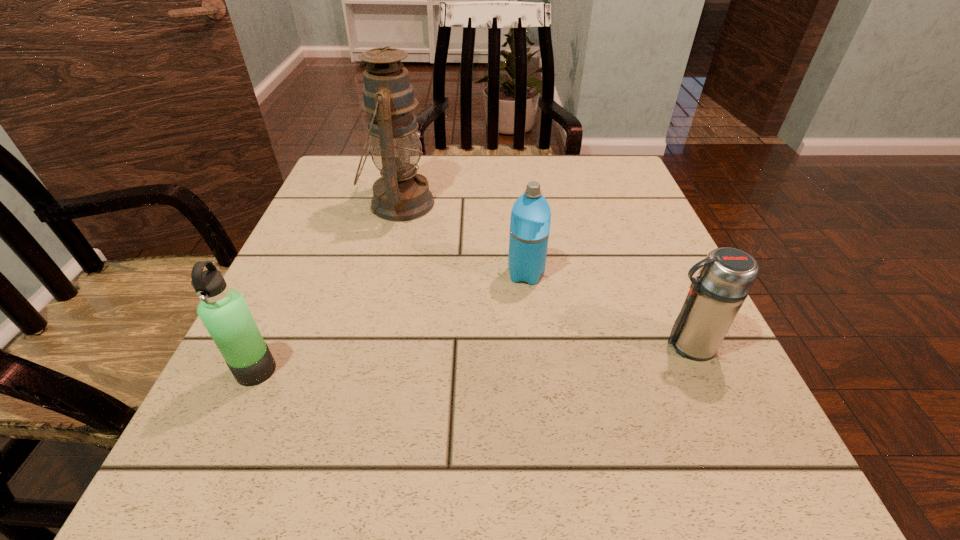
The width and height of the screenshot is (960, 540). In the image, there is a desktop. In order to click on free space at the right edge in this screenshot , I will do `click(646, 256)`.

Where is `vacant space at the far left corner of the desktop`? Image resolution: width=960 pixels, height=540 pixels. vacant space at the far left corner of the desktop is located at coordinates (321, 201).

At what (x,y) coordinates should I click in order to perform the action: click on vacant space at the far right corner of the desktop. Please return your answer as a coordinate pair (x, y). This screenshot has height=540, width=960. Looking at the image, I should click on (591, 156).

Image resolution: width=960 pixels, height=540 pixels. In the image, there is a desktop. Identify the location of vacant space at the near right corner. pyautogui.click(x=769, y=481).

Where is `free space between the leftmost thermos bottle and the third object from left to right`? free space between the leftmost thermos bottle and the third object from left to right is located at coordinates (391, 322).

This screenshot has width=960, height=540. I want to click on vacant space that is in between the second thermos bottle from left to right and the oil lamp, so click(463, 239).

In order to click on free point between the third object from left to right and the third object from right to left in this screenshot , I will do `click(463, 239)`.

Find the location of a particular element. Image resolution: width=960 pixels, height=540 pixels. vacant area that lies between the third object from left to right and the oil lamp is located at coordinates (463, 239).

Identify the location of unoccupied area between the farthest object and the second thermos bottle from right to left. (463, 239).

Find the location of a particular element. free area in between the oil lamp and the second thermos bottle from right to left is located at coordinates (463, 239).